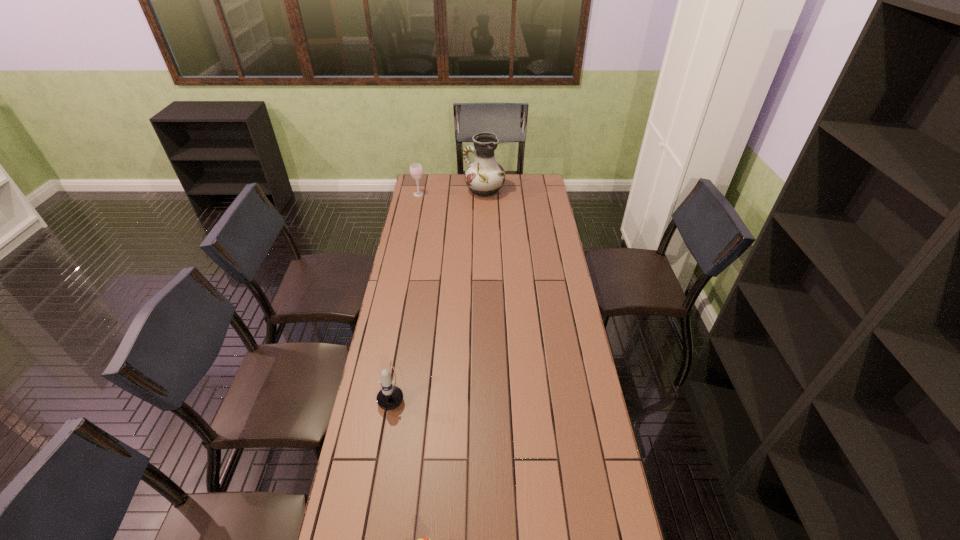
Where is `vase`? This screenshot has width=960, height=540. vase is located at coordinates (484, 177).

You are a GUI agent. You are given a task and a screenshot of the screen. Output one action in this format:
    pyautogui.click(x=<x>, y=<y>)
    Task: Click on the tallest object
    The image size is (960, 540).
    Given the screenshot: What is the action you would take?
    pyautogui.click(x=484, y=177)

This screenshot has height=540, width=960. Find the location of `wineglass`. wineglass is located at coordinates (416, 170).

You are a GUI agent. You are given a task and a screenshot of the screen. Output one action in this format:
    pyautogui.click(x=<x>, y=<y>)
    Task: Click on the third farthest object
    
    Given the screenshot: What is the action you would take?
    pyautogui.click(x=390, y=397)

This screenshot has height=540, width=960. What are the coordinates of `free spot located 0.270m on the left of the rightmost object` in the screenshot? It's located at (415, 191).

At what (x,y) coordinates should I click in order to perform the action: click on free spot located on the right of the wineglass. Please return your answer as a coordinate pair (x, y). Looking at the image, I should click on (482, 194).

Where is `free space located on the front of the second nearest object`? The height and width of the screenshot is (540, 960). free space located on the front of the second nearest object is located at coordinates (373, 504).

Identify the location of vase situated at the far edge. This screenshot has height=540, width=960. (484, 177).

I want to click on wineglass that is positioned at the far edge, so click(416, 170).

You are a GUI agent. You are given a task and a screenshot of the screen. Output one action in this format:
    pyautogui.click(x=<x>, y=<y>)
    Task: Click on the wineglass situated at the left edge
    
    Given the screenshot: What is the action you would take?
    point(416,170)